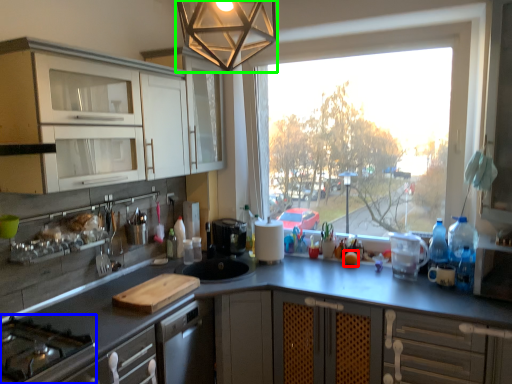
Question: Which object is positioned closest to orange (highlighted by a red box)? Select from gas stove (highlighted by a blue box) and light fixture (highlighted by a green box).

Choices:
 (A) gas stove
 (B) light fixture

Answer: (B)